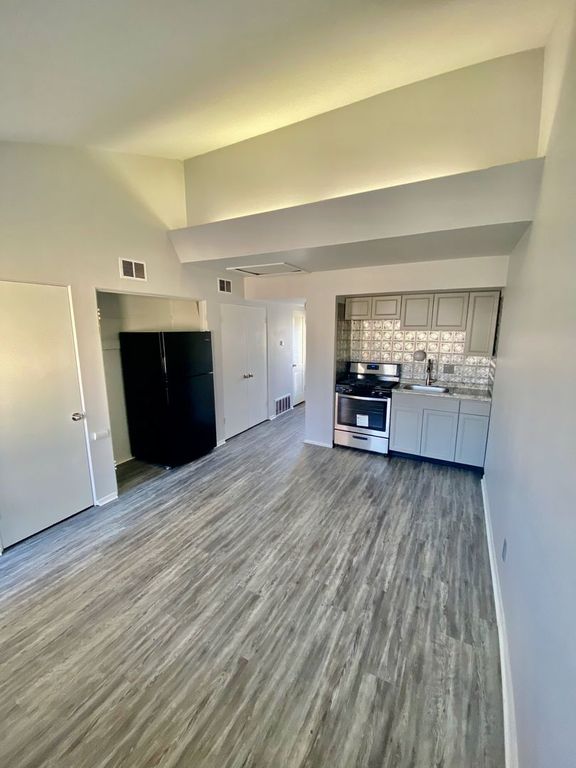
What are the coordinates of `attach door` in the screenshot? It's located at (275, 272).